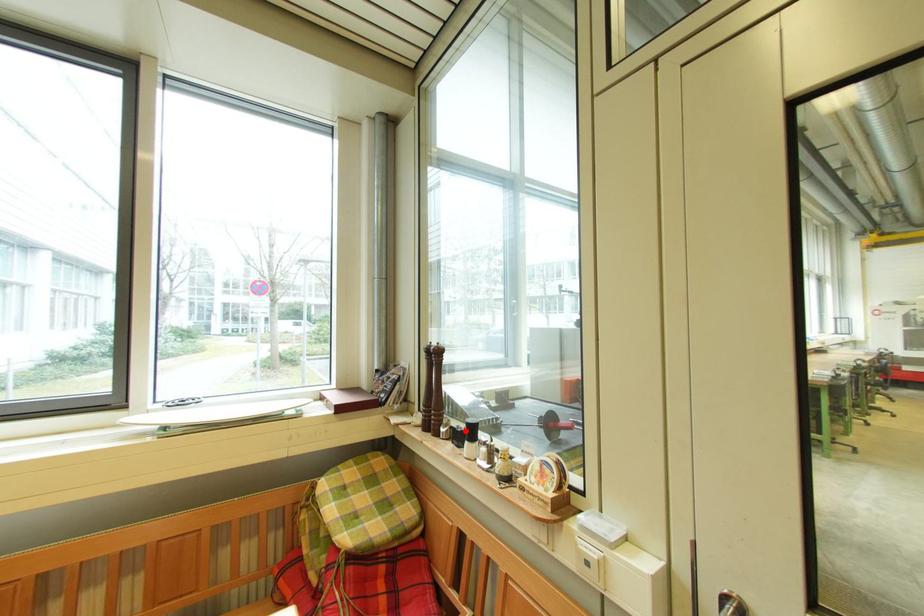
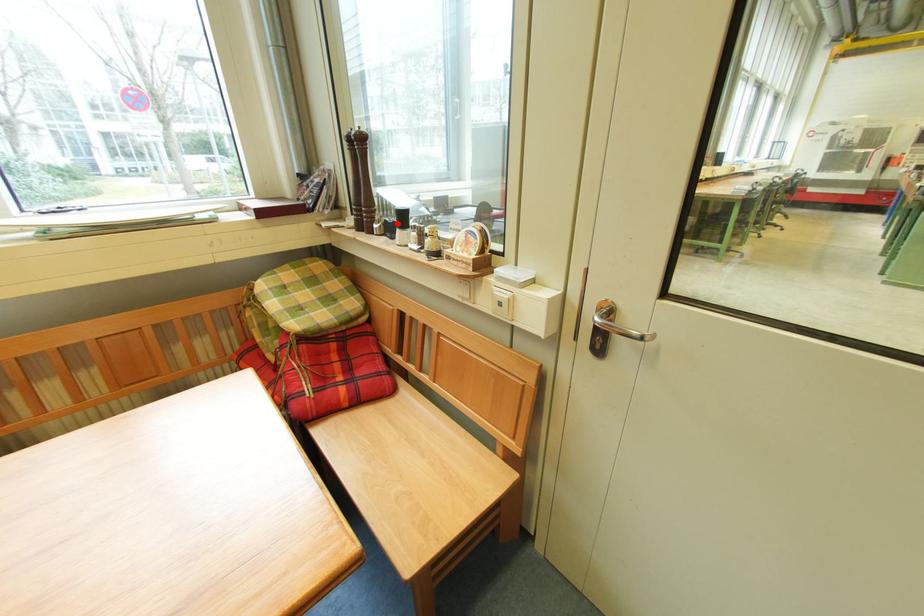
I am providing you with two images of the same scene from different viewpoints. A red point is marked on the first image and another point is marked on the second image. Are the points marked in image1 and image2 representing the same 3D position?

Yes